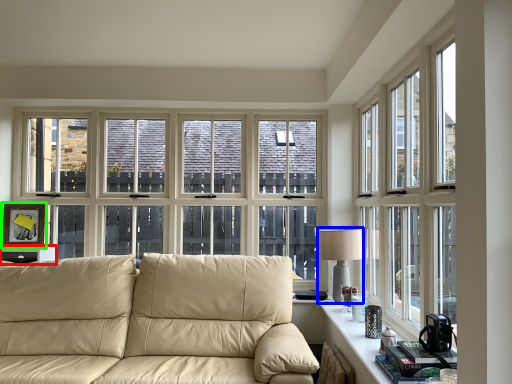
Question: Which is nearer to the side table (highlighted by a red box)? table lamp (highlighted by a blue box) or picture frame (highlighted by a green box).

Choices:
 (A) table lamp
 (B) picture frame

Answer: (B)